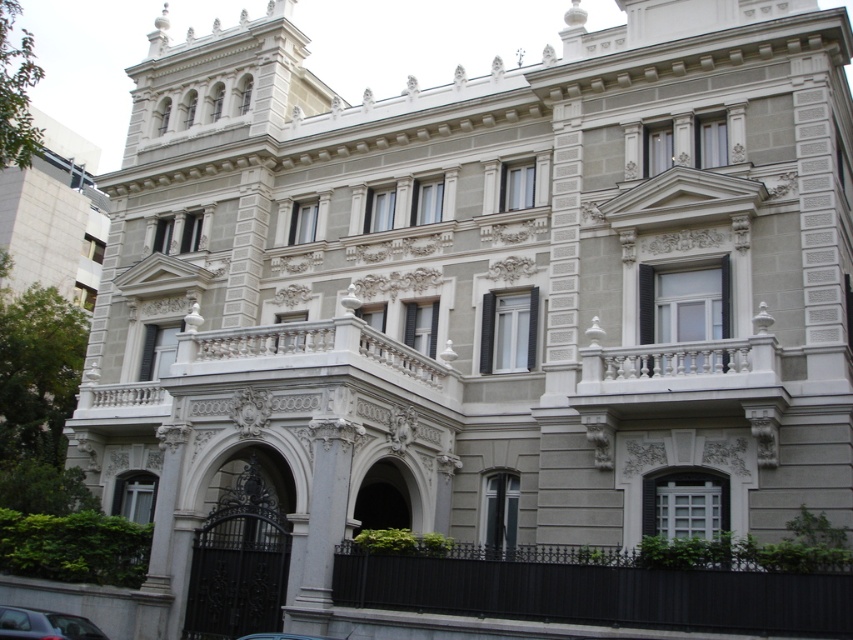
Question: Is metallic blue car at lower left closer to the viewer compared to metallic silver car at center?

Choices:
 (A) yes
 (B) no

Answer: (B)

Question: Among these objects, which one is farthest from the camera?

Choices:
 (A) metallic silver car at center
 (B) metallic blue car at lower left

Answer: (B)

Question: Among these objects, which one is nearest to the camera?

Choices:
 (A) metallic blue car at lower left
 (B) metallic silver car at center

Answer: (B)

Question: Observing the image, what is the correct spatial positioning of metallic blue car at lower left in reference to metallic silver car at center?

Choices:
 (A) above
 (B) below

Answer: (B)

Question: Which point is closer to the camera?

Choices:
 (A) metallic silver car at center
 (B) metallic blue car at lower left

Answer: (A)

Question: Does metallic blue car at lower left lie in front of metallic silver car at center?

Choices:
 (A) yes
 (B) no

Answer: (B)